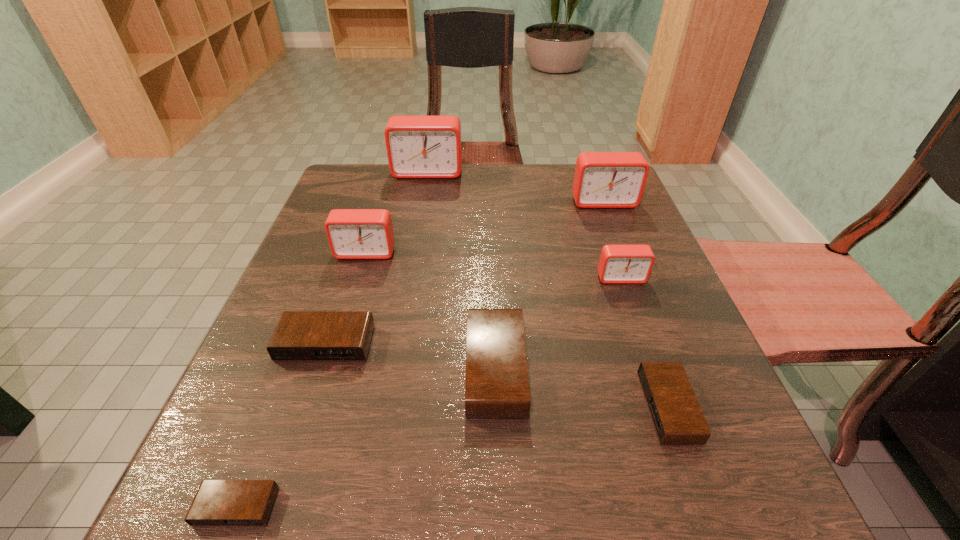
Find the location of `the third shortest object`. the third shortest object is located at coordinates (300, 336).

This screenshot has width=960, height=540. Find the location of `the sixth tallest alarm clock`. the sixth tallest alarm clock is located at coordinates (300, 336).

Find the location of a particular element. The image size is (960, 540). the second shortest alarm clock is located at coordinates (677, 417).

The width and height of the screenshot is (960, 540). I want to click on the second shortest object, so click(677, 417).

Locate an element on the screen. The image size is (960, 540). the nearest black alarm clock is located at coordinates coord(218,503).

Where is `the nearest alarm clock`? Image resolution: width=960 pixels, height=540 pixels. the nearest alarm clock is located at coordinates (218, 503).

I want to click on vacant space located on the front-facing side of the tallest object, so click(x=411, y=268).

I want to click on vacant space located on the front-facing side of the second farthest red alarm clock, so point(623,253).

Where is `vacant space situated on the front-facing side of the third farthest red alarm clock`? The image size is (960, 540). vacant space situated on the front-facing side of the third farthest red alarm clock is located at coordinates (347, 316).

What are the coordinates of `vacant space located on the front-facing side of the nearest red alarm clock` in the screenshot? It's located at (688, 468).